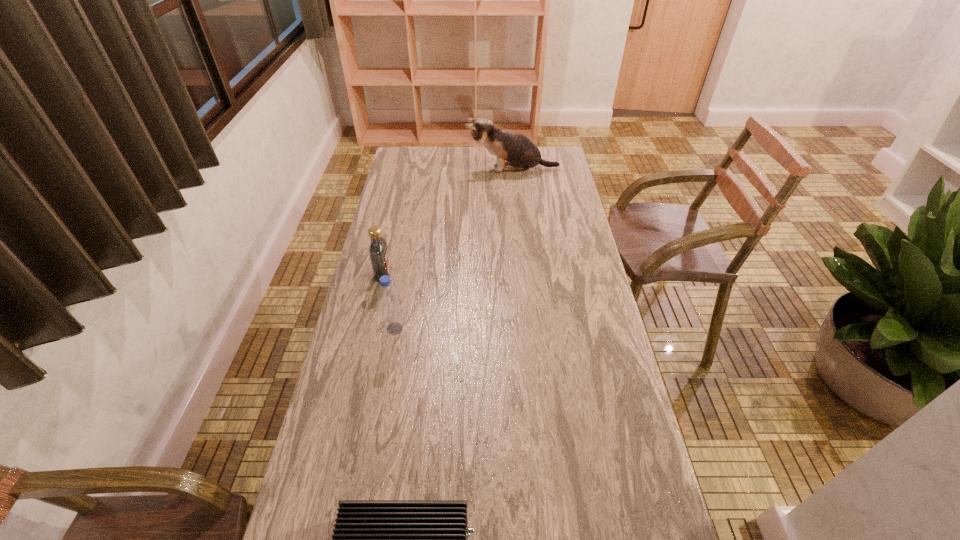
Locate an element on the screen. The width and height of the screenshot is (960, 540). cat is located at coordinates (520, 153).

Locate an element on the screen. Image resolution: width=960 pixels, height=540 pixels. bottle is located at coordinates (388, 297).

Where is `vodka`? vodka is located at coordinates (378, 250).

This screenshot has width=960, height=540. I want to click on the third nearest object, so click(x=378, y=250).

Where is `vacant space located at the face of the farthest object`? vacant space located at the face of the farthest object is located at coordinates (421, 169).

Find the location of a particular element. The image size is (960, 540). free region located 0.110m at the face of the farthest object is located at coordinates (442, 169).

At what (x,y) coordinates should I click in order to perform the action: click on free region located 0.050m at the face of the farthest object. Please return your answer as a coordinate pair (x, y). Looking at the image, I should click on (454, 169).

This screenshot has width=960, height=540. Find the location of `free space located on the back of the second nearest object`. free space located on the back of the second nearest object is located at coordinates (407, 259).

Locate an element on the screen. vacant region located 0.050m on the front-facing side of the second farthest object is located at coordinates (406, 274).

The width and height of the screenshot is (960, 540). What are the coordinates of `object located at the far edge` in the screenshot? It's located at (520, 153).